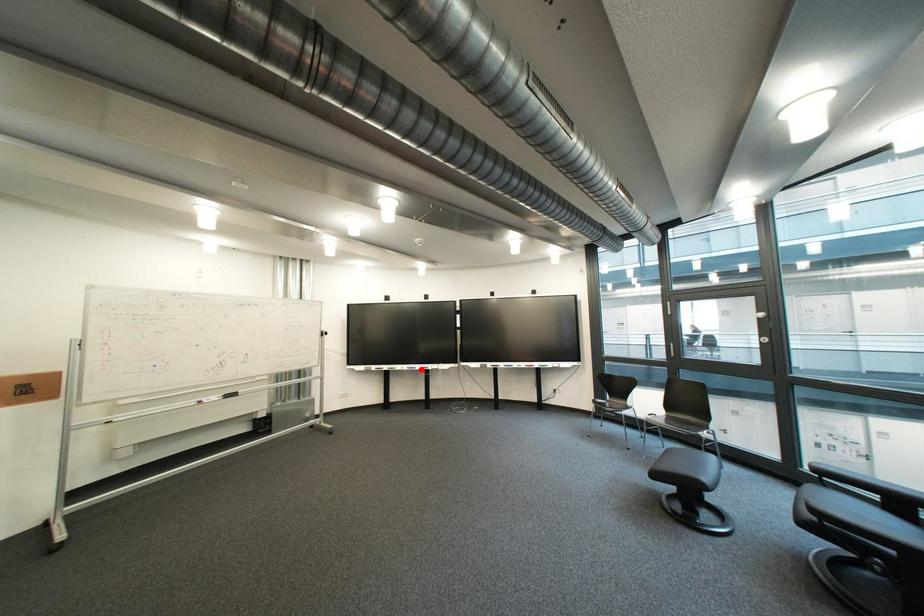
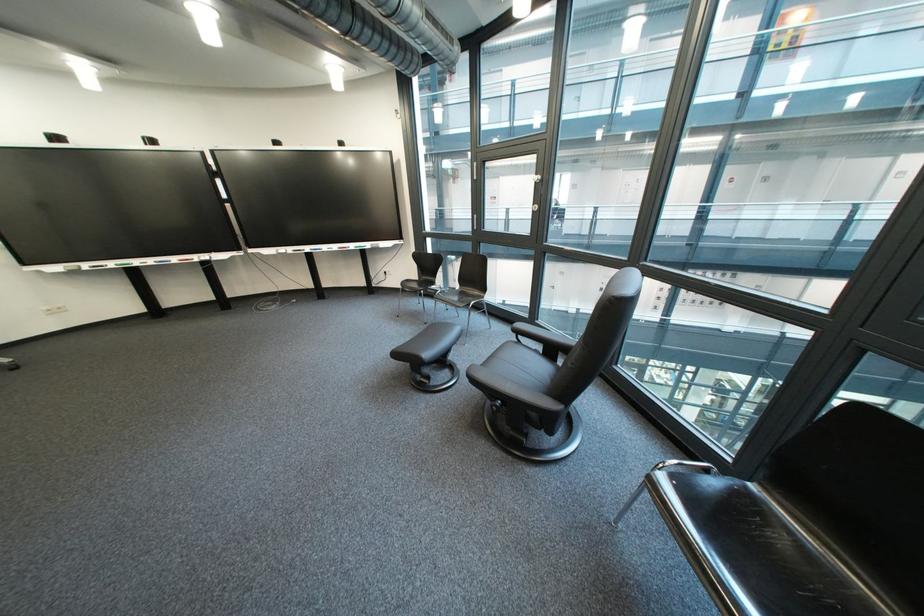
Find the pixel in the second image that matches the highlighted location in the first image.

(169, 264)